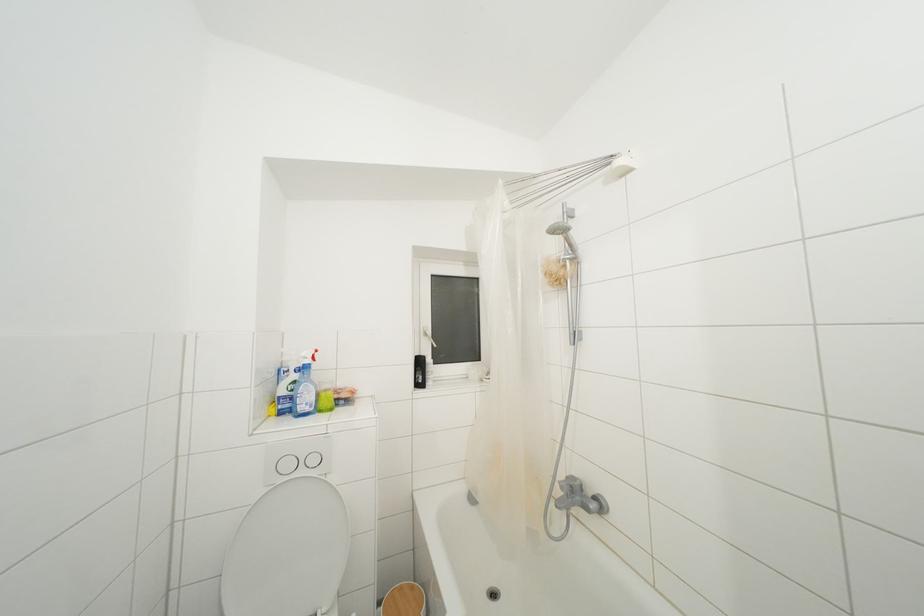
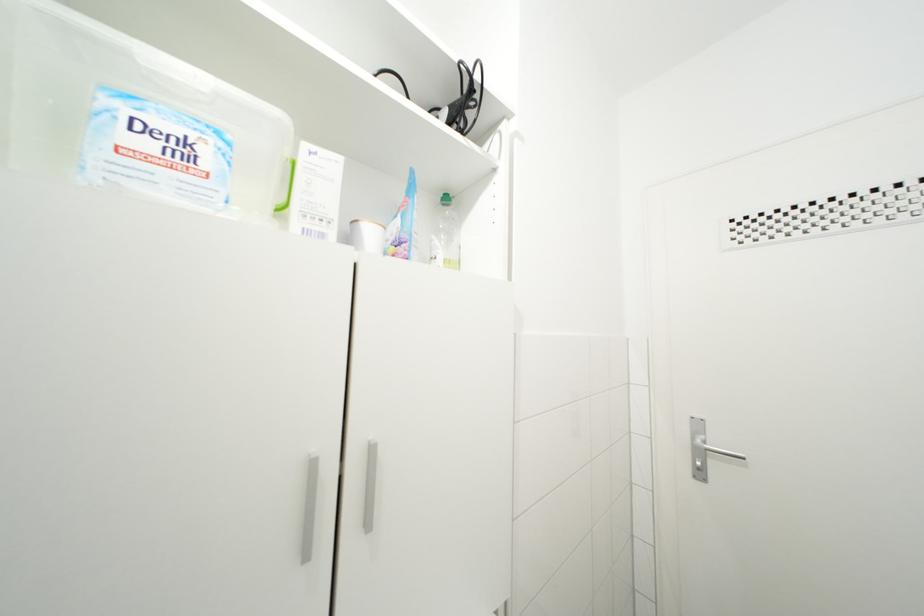
Question: How did the camera likely rotate?

Choices:
 (A) Left
 (B) Right
 (C) Up
 (D) Down

Answer: (B)